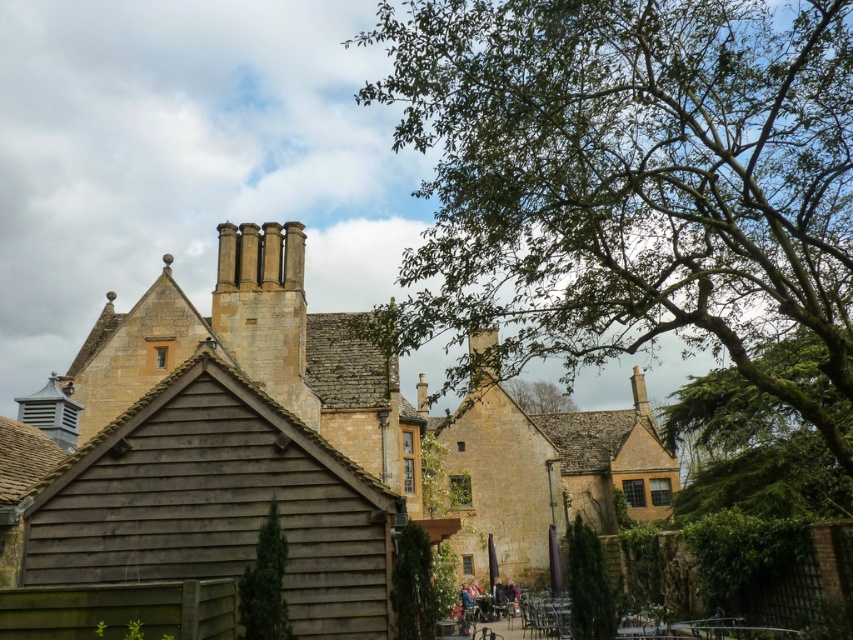
What do you see at coordinates (635, 182) in the screenshot? I see `green leafy tree at upper center` at bounding box center [635, 182].

Does green leafy tree at upper center appear over green leafy tree at center?

Yes, green leafy tree at upper center is above green leafy tree at center.

The height and width of the screenshot is (640, 853). What do you see at coordinates (635, 182) in the screenshot?
I see `green leafy tree at upper center` at bounding box center [635, 182].

At what (x,y) coordinates should I click in order to perform the action: click on green leafy tree at upper center. Please return your answer as a coordinate pair (x, y). Looking at the image, I should click on (635, 182).

Which is above, green textured tree at center or green textured hedge at lower center?

green textured tree at center

From the picture: Is green textured tree at center closer to the viewer compared to green textured hedge at lower center?

Yes, it is.

Is point (277, 624) less distant than point (585, 589)?

That is True.

The height and width of the screenshot is (640, 853). Find the location of `green textured tree at center`. green textured tree at center is located at coordinates (265, 584).

Can you confirm if green leafy tree at upper center is smaller than green textured hedge at lower center?

No, green leafy tree at upper center is not smaller than green textured hedge at lower center.

Between green leafy tree at upper center and green textured hedge at lower center, which one is positioned higher?

green leafy tree at upper center is above.

Is point (596, 298) closer to viewer compared to point (589, 560)?

No.

Identify the location of green leafy tree at upper center. The image size is (853, 640). (635, 182).